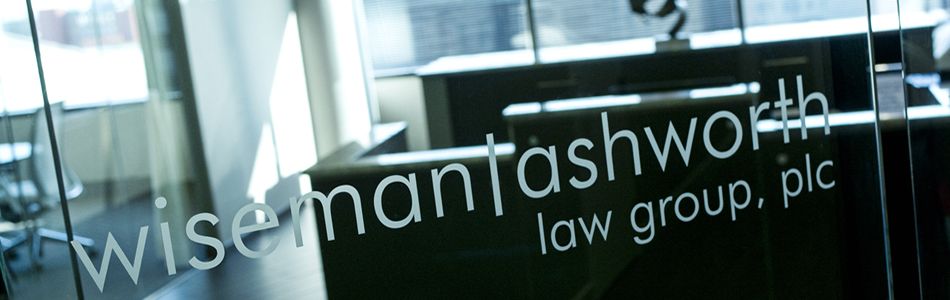
Where is `the back of chair`? This screenshot has width=950, height=300. the back of chair is located at coordinates (30, 135).